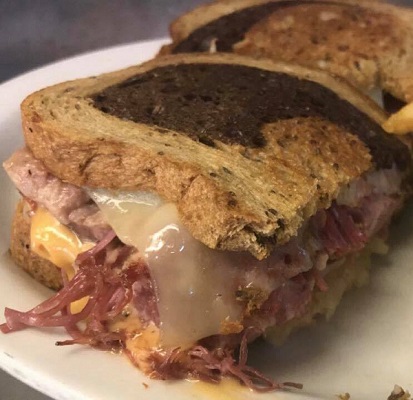
Locate an element on the screen. white plate is located at coordinates (82, 379).